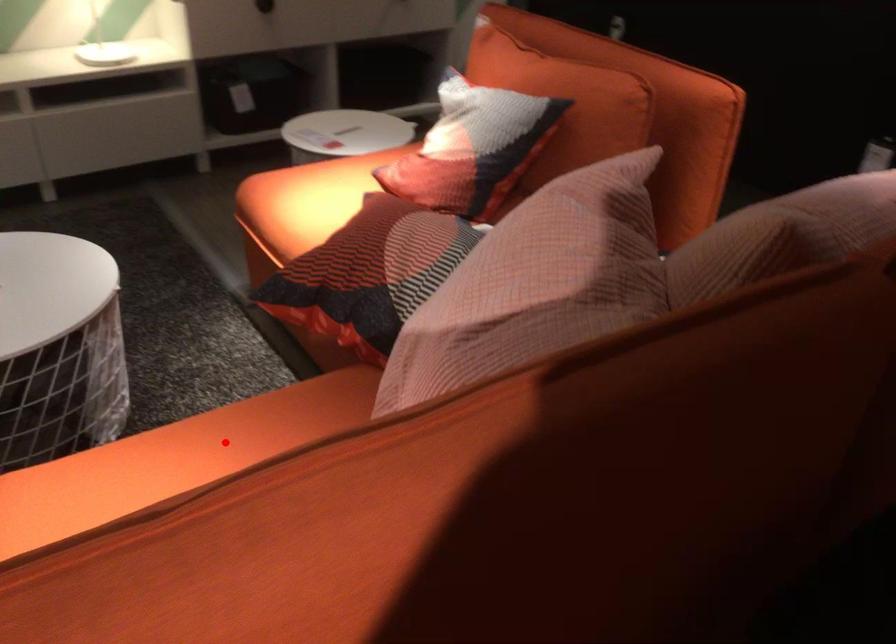
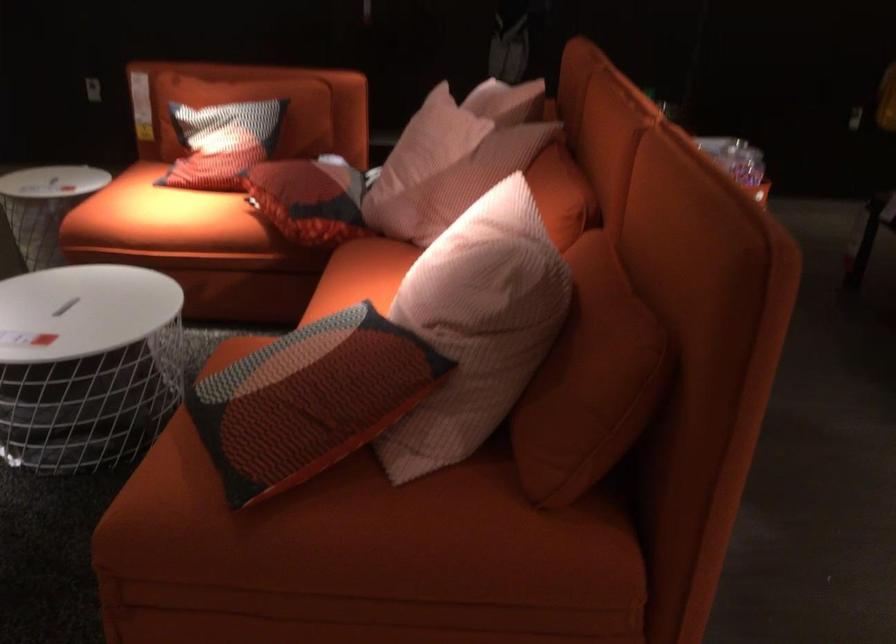
In the second image, find the point that corresponds to the highlighted location in the first image.

(360, 276)